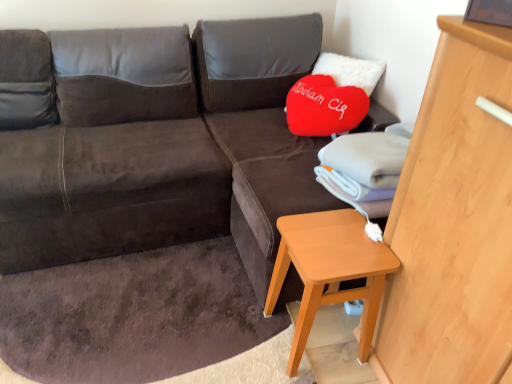
The image size is (512, 384). What are the coordinates of `dark brown fabric couch at center` in the screenshot? It's located at (160, 143).

Describe the element at coordinates (329, 269) in the screenshot. I see `orange wood side table at lower right` at that location.

What do you see at coordinates (453, 222) in the screenshot? This screenshot has height=384, width=512. I see `light wood dresser at right` at bounding box center [453, 222].

Locate an element on the screen. suede-like brown bean bag at left is located at coordinates (112, 155).

Is point (168, 63) closer or farther from the camera than point (415, 288)?

Point (168, 63) appears to be farther away from the viewer than point (415, 288).

How different are the orientations of dark brown fabric couch at center and light wood dresser at right in degrees?

The angle between the facing direction of dark brown fabric couch at center and the facing direction of light wood dresser at right is 90.3 degrees.

Can you confirm if dark brown fabric couch at center is positioned to the left of light wood dresser at right?

Correct, you'll find dark brown fabric couch at center to the left of light wood dresser at right.

Is dark brown fabric couch at center placed right next to light wood dresser at right?

No.

The height and width of the screenshot is (384, 512). I want to click on bean bag chair behind the dark brown fabric couch at center, so click(112, 155).

From the image's perspective, is dark brown fabric couch at center located above or below suede-like brown bean bag at left?

Clearly, from the image's perspective, dark brown fabric couch at center is below suede-like brown bean bag at left.

Is dark brown fabric couch at center not within suede-like brown bean bag at left?

No, dark brown fabric couch at center is not entirely external to suede-like brown bean bag at left.

Does orange wood side table at lower right contain light wood dresser at right?

No, orange wood side table at lower right does not contain light wood dresser at right.

Does point (314, 248) lie behind point (426, 200)?

That is True.

Is orange wood side table at lower right positioned with its back to light wood dresser at right?

No, light wood dresser at right is not at the back of orange wood side table at lower right.

Looking at their sizes, would you say orange wood side table at lower right is wider or thinner than light wood dresser at right?

Clearly, orange wood side table at lower right has less width compared to light wood dresser at right.

Does light wood dresser at right appear on the right side of dark brown fabric couch at center?

Indeed, light wood dresser at right is positioned on the right side of dark brown fabric couch at center.

Is light wood dresser at right next to dark brown fabric couch at center and touching it?

No, light wood dresser at right is not in contact with dark brown fabric couch at center.

From their relative heights in the image, would you say light wood dresser at right is taller or shorter than dark brown fabric couch at center?

In the image, light wood dresser at right appears to be taller than dark brown fabric couch at center.

From a real-world perspective, relative to dark brown fabric couch at center, is light wood dresser at right vertically above or below?

Clearly, from a real-world perspective, light wood dresser at right is above dark brown fabric couch at center.

Considering the sizes of objects suede-like brown bean bag at left and orange wood side table at lower right in the image provided, who is wider, suede-like brown bean bag at left or orange wood side table at lower right?

With larger width is suede-like brown bean bag at left.

From the image's perspective, between suede-like brown bean bag at left and orange wood side table at lower right, which one is located above?

suede-like brown bean bag at left, from the image's perspective.

This screenshot has height=384, width=512. In order to click on bean bag chair behind the orange wood side table at lower right in this screenshot , I will do `click(112, 155)`.

Is dark brown fabric couch at center oriented towards orange wood side table at lower right?

Yes, dark brown fabric couch at center is aimed at orange wood side table at lower right.

Can orange wood side table at lower right be found inside dark brown fabric couch at center?

No, orange wood side table at lower right is not inside dark brown fabric couch at center.

Considering the relative positions of dark brown fabric couch at center and orange wood side table at lower right in the image provided, is dark brown fabric couch at center in front of orange wood side table at lower right?

Yes, it is in front of orange wood side table at lower right.

Considering their positions, is light wood dresser at right located in front of or behind orange wood side table at lower right?

light wood dresser at right is in front of orange wood side table at lower right.

Between light wood dresser at right and orange wood side table at lower right, which one appears on the left side from the viewer's perspective?

Positioned to the left is orange wood side table at lower right.

Does point (440, 238) lie behind point (281, 245)?

No, it is in front of (281, 245).

Image resolution: width=512 pixels, height=384 pixels. There is a dark brown fabric couch at center. In order to click on dresser above it (from a real-world perspective) in this screenshot , I will do `click(453, 222)`.

Identify the location of bean bag chair that is behind the dark brown fabric couch at center. This screenshot has height=384, width=512. (112, 155).

Based on their spatial positions, is orange wood side table at lower right or suede-like brown bean bag at left closer to dark brown fabric couch at center?

suede-like brown bean bag at left is closer to dark brown fabric couch at center.

From the picture: Looking at the image, which one is located closer to dark brown fabric couch at center, suede-like brown bean bag at left or light wood dresser at right?

suede-like brown bean bag at left.

Based on their spatial positions, is light wood dresser at right or dark brown fabric couch at center closer to suede-like brown bean bag at left?

The object closer to suede-like brown bean bag at left is dark brown fabric couch at center.

Based on their spatial positions, is light wood dresser at right or suede-like brown bean bag at left further from dark brown fabric couch at center?

light wood dresser at right is positioned further to the anchor dark brown fabric couch at center.

When comparing their distances from orange wood side table at lower right, does light wood dresser at right or dark brown fabric couch at center seem closer?

Among the two, light wood dresser at right is located nearer to orange wood side table at lower right.

Estimate the real-world distances between objects in this image. Which object is further from orange wood side table at lower right, dark brown fabric couch at center or suede-like brown bean bag at left?

suede-like brown bean bag at left is further to orange wood side table at lower right.

Considering their positions, is orange wood side table at lower right positioned further to light wood dresser at right than dark brown fabric couch at center?

dark brown fabric couch at center.

Estimate the real-world distances between objects in this image. Which object is closer to light wood dresser at right, suede-like brown bean bag at left or orange wood side table at lower right?

orange wood side table at lower right lies closer to light wood dresser at right than the other object.

At what (x,y) coordinates should I click in order to perform the action: click on table between dark brown fabric couch at center and light wood dresser at right. Please return your answer as a coordinate pair (x, y). This screenshot has width=512, height=384. Looking at the image, I should click on (329, 269).

Locate an element on the screen. studio couch between suede-like brown bean bag at left and orange wood side table at lower right from left to right is located at coordinates (160, 143).

This screenshot has width=512, height=384. I want to click on table between suede-like brown bean bag at left and light wood dresser at right from left to right, so click(329, 269).

Locate an element on the screen. The height and width of the screenshot is (384, 512). studio couch situated between suede-like brown bean bag at left and light wood dresser at right from left to right is located at coordinates (160, 143).